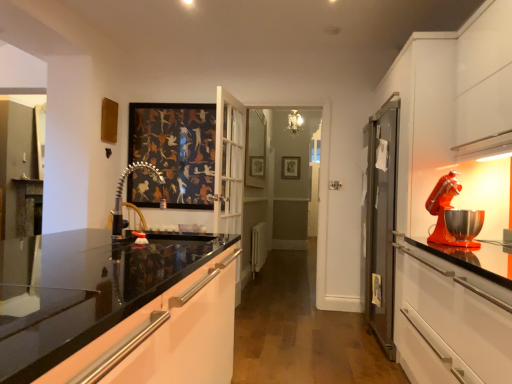
Question: Considering the positions of polished chrome faucet at center and shiny orange mixer at right in the image, is polished chrome faucet at center wider or thinner than shiny orange mixer at right?

Choices:
 (A) thin
 (B) wide

Answer: (B)

Question: In terms of size, does polished chrome faucet at center appear bigger or smaller than shiny orange mixer at right?

Choices:
 (A) small
 (B) big

Answer: (A)

Question: Based on their relative distances, which object is farther from the polished chrome faucet at center?

Choices:
 (A) wooden picture frame at center
 (B) glossy white cabinet at center
 (C) white plastic radiator at center
 (D) shiny orange mixer at right

Answer: (A)

Question: Which is farther from the shiny orange mixer at right?

Choices:
 (A) wooden picture frame at center
 (B) polished chrome faucet at center
 (C) white plastic radiator at center
 (D) glossy white cabinet at center

Answer: (A)